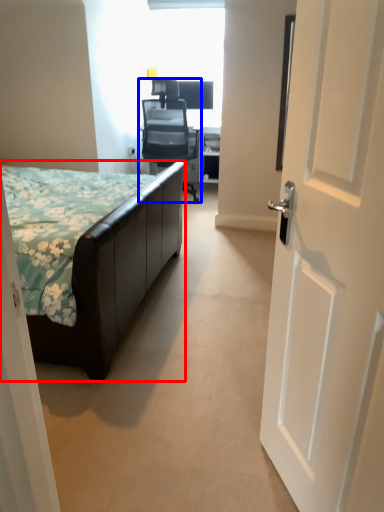
Question: Which object is closer to the camera taking this photo, bed (highlighted by a red box) or chair (highlighted by a blue box)?

Choices:
 (A) bed
 (B) chair

Answer: (A)